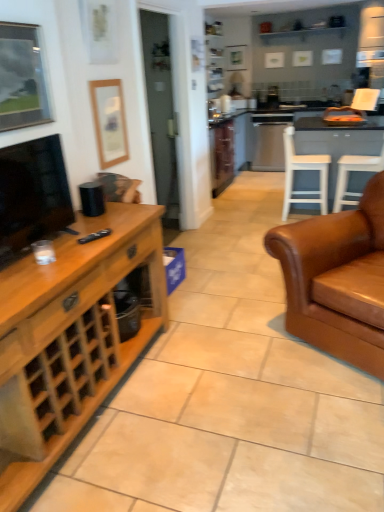
Question: Would you say white wood chair at center, positioned as the 1th chair in left-to-right order, is to the left or to the right of wooden picture frame at upper left, marked as the second picture frame in a front-to-back arrangement, in the picture?

Choices:
 (A) right
 (B) left

Answer: (A)

Question: Considering the positions of point (326, 158) and point (94, 80), is point (326, 158) closer or farther from the camera than point (94, 80)?

Choices:
 (A) farther
 (B) closer

Answer: (A)

Question: Estimate the real-world distances between objects in this image. Which object is closer to the brown leather couch at right?

Choices:
 (A) matte black tv at left
 (B) metallic silver picture frame at upper left, which is the second picture frame from back to front
 (C) wooden cabinet at left
 (D) white plastic chair at right, the 1th chair in the right-to-left sequence
 (E) wooden picture frame at upper left, which is the first picture frame from right to left

Answer: (C)

Question: Which object is positioned farthest from the matte black tv at left?

Choices:
 (A) white wood table at right
 (B) white plastic chair at right, which is the second chair from left to right
 (C) wooden picture frame at upper left, the first picture frame in the back-to-front sequence
 (D) wooden cabinet at left
 (E) black matte remote at center

Answer: (B)